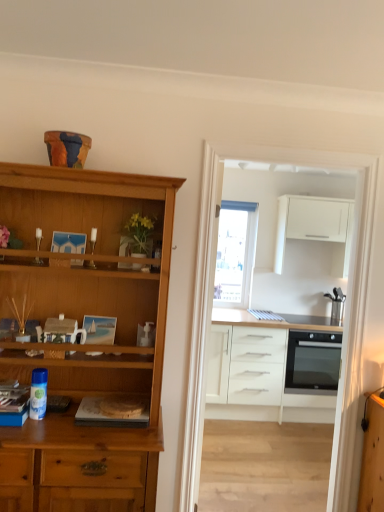
This screenshot has height=512, width=384. Find the location of `yellow artificial flowers in plastic at center`. yellow artificial flowers in plastic at center is located at coordinates pos(139,234).

What do you see at coordinates (313, 224) in the screenshot?
I see `white matte cabinet at upper right, acting as the second cabinetry starting from the bottom` at bounding box center [313, 224].

I want to click on matte wooden picture frame at center, so click(99, 329).

From the image's perspective, is white matte cabinet at upper right, acting as the second cabinetry starting from the bottom, above or below transparent glass window at center?

white matte cabinet at upper right, acting as the second cabinetry starting from the bottom, is situated higher than transparent glass window at center in the image.

Can you confirm if white matte cabinet at upper right, acting as the second cabinetry starting from the bottom, is wider than transparent glass window at center?

Indeed, white matte cabinet at upper right, acting as the second cabinetry starting from the bottom, has a greater width compared to transparent glass window at center.

Based on their sizes in the image, would you say white matte cabinet at upper right, acting as the second cabinetry starting from the bottom, is bigger or smaller than transparent glass window at center?

Considering their sizes, white matte cabinet at upper right, acting as the second cabinetry starting from the bottom, takes up more space than transparent glass window at center.

Can you confirm if white glossy cabinets at center is thinner than black glass oven at right?

Yes, white glossy cabinets at center is thinner than black glass oven at right.

Image resolution: width=384 pixels, height=512 pixels. I want to click on oven that appears on the right of white glossy cabinets at center, so click(x=313, y=362).

From a real-world perspective, is white glossy cabinets at center above or below black glass oven at right?

Clearly, from a real-world perspective, white glossy cabinets at center is above black glass oven at right.

Based on the photo, measure the distance between white glossy cabinets at center and black glass oven at right.

white glossy cabinets at center and black glass oven at right are 11.43 inches apart.

Who is bigger, white matte cabinet at center, which is the 2th cabinetry in top-to-bottom order, or yellow artificial flowers in plastic at center?

white matte cabinet at center, which is the 2th cabinetry in top-to-bottom order.

Does white matte cabinet at center, which is the 2th cabinetry in top-to-bottom order, contain yellow artificial flowers in plastic at center?

No, yellow artificial flowers in plastic at center is located outside of white matte cabinet at center, which is the 2th cabinetry in top-to-bottom order.

Which is closer to the camera, (309, 322) or (126, 228)?

Point (309, 322) is positioned farther from the camera compared to point (126, 228).

Is transparent glass window at center facing towards white glossy cabinets at center?

Yes, transparent glass window at center is turned towards white glossy cabinets at center.

Can you confirm if transparent glass window at center is smaller than white glossy cabinets at center?

Yes.

From the image's perspective, which object appears higher, transparent glass window at center or white glossy cabinets at center?

transparent glass window at center, from the image's perspective.

I want to click on window located behind the white glossy cabinets at center, so click(235, 253).

From the image's perspective, does transparent glass window at center appear higher than yellow artificial flowers in plastic at center?

Incorrect, from the image's perspective, transparent glass window at center is lower than yellow artificial flowers in plastic at center.

Looking at the image, does transparent glass window at center seem bigger or smaller compared to yellow artificial flowers in plastic at center?

In the image, transparent glass window at center appears to be larger than yellow artificial flowers in plastic at center.

Could you measure the distance between transparent glass window at center and yellow artificial flowers in plastic at center?

They are 9.37 feet apart.

Would you consider transparent glass window at center to be distant from yellow artificial flowers in plastic at center?

transparent glass window at center is far away from yellow artificial flowers in plastic at center.

From the picture: Between transparent glass window at center and white matte cabinet at center, which is the 2th cabinetry in top-to-bottom order, which one is positioned in front?

white matte cabinet at center, which is the 2th cabinetry in top-to-bottom order, is more forward.

Considering the sizes of objects transparent glass window at center and white matte cabinet at center, the 1th cabinetry positioned from the bottom, in the image provided, who is bigger, transparent glass window at center or white matte cabinet at center, the 1th cabinetry positioned from the bottom,?

white matte cabinet at center, the 1th cabinetry positioned from the bottom.

Is transparent glass window at center not near white matte cabinet at center, the 1th cabinetry positioned from the bottom?

No, transparent glass window at center is not far away from white matte cabinet at center, the 1th cabinetry positioned from the bottom.

Which object is further away from the camera, black glass oven at right or white glossy cabinets at center?

black glass oven at right is further away from the camera.

Is black glass oven at right positioned far away from white glossy cabinets at center?

No, black glass oven at right is in close proximity to white glossy cabinets at center.

Where is `the 1st cabinetry in front of the transparent glass window at center, starting your count from the anchor`? This screenshot has height=512, width=384. the 1st cabinetry in front of the transparent glass window at center, starting your count from the anchor is located at coordinates (313, 224).

Identify the location of entertainment center on the left of the black glass oven at right. (349, 317).

From the image, which object appears to be farther from black glass oven at right, matte wooden picture frame at center or transparent glass window at center?

matte wooden picture frame at center is further to black glass oven at right.

Based on their spatial positions, is white matte cabinet at upper right, acting as the second cabinetry starting from the bottom, or matte wooden picture frame at center closer to white glossy cabinets at center?

white matte cabinet at upper right, acting as the second cabinetry starting from the bottom, is positioned closer to the anchor white glossy cabinets at center.

Which object lies further to the anchor point yellow artificial flowers in plastic at center, matte wooden picture frame at center or transparent glass window at center?

Based on the image, transparent glass window at center appears to be further to yellow artificial flowers in plastic at center.

Based on the photo, considering their positions, is matte wooden picture frame at center positioned closer to yellow artificial flowers in plastic at center than white matte cabinet at center, the 1th cabinetry positioned from the bottom?

matte wooden picture frame at center is closer to yellow artificial flowers in plastic at center.

When comparing their distances from yellow artificial flowers in plastic at center, does white matte cabinet at center, the 1th cabinetry positioned from the bottom, or white matte cabinet at upper right, acting as the second cabinetry starting from the bottom, seem further?

Among the two, white matte cabinet at upper right, acting as the second cabinetry starting from the bottom, is located further to yellow artificial flowers in plastic at center.

When comparing their distances from white matte cabinet at upper right, arranged as the 1th cabinetry when viewed from the top, does black glass oven at right or white matte cabinet at center, which is the 2th cabinetry in top-to-bottom order, seem closer?

black glass oven at right lies closer to white matte cabinet at upper right, arranged as the 1th cabinetry when viewed from the top, than the other object.

Which object lies nearer to the anchor point white glossy cabinets at center, matte wooden picture frame at center or yellow artificial flowers in plastic at center?

matte wooden picture frame at center is closer to white glossy cabinets at center.

Looking at the image, which one is located closer to black glass oven at right, white glossy cabinets at center or white matte cabinet at center, which is the 2th cabinetry in top-to-bottom order?

The object closer to black glass oven at right is white matte cabinet at center, which is the 2th cabinetry in top-to-bottom order.

Identify the location of entertainment center between yellow artificial flowers in plastic at center and white matte cabinet at upper right, arranged as the 1th cabinetry when viewed from the top, from front to back. (349, 317).

This screenshot has height=512, width=384. What are the coordinates of `cabinetry between yellow artificial flowers in plastic at center and black glass oven at right from front to back` in the screenshot? It's located at (260, 369).

The width and height of the screenshot is (384, 512). I want to click on cabinetry between matte wooden picture frame at center and black glass oven at right along the z-axis, so click(x=260, y=369).

Locate an element on the screen. The width and height of the screenshot is (384, 512). entertainment center between matte wooden picture frame at center and white matte cabinet at upper right, arranged as the 1th cabinetry when viewed from the top, along the z-axis is located at coordinates (349, 317).